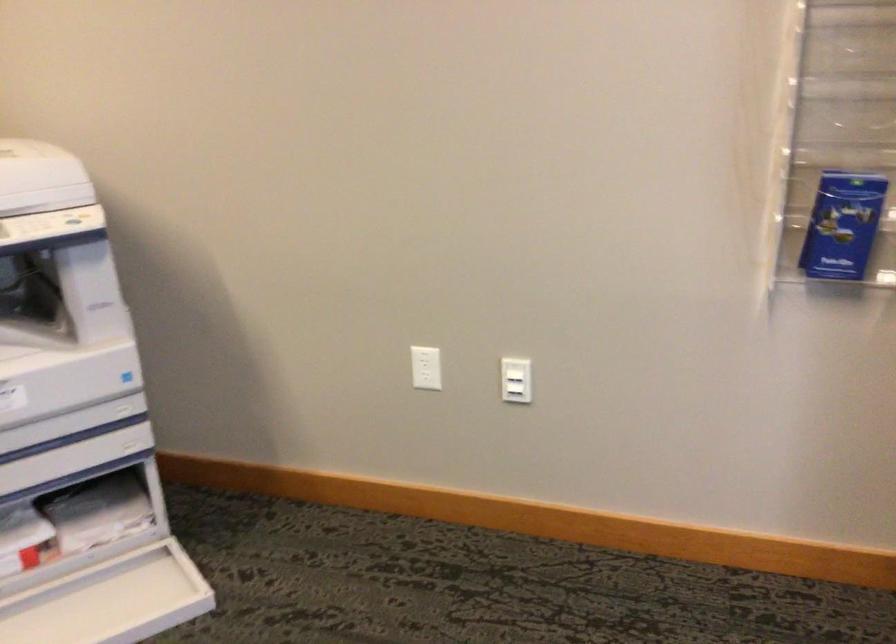
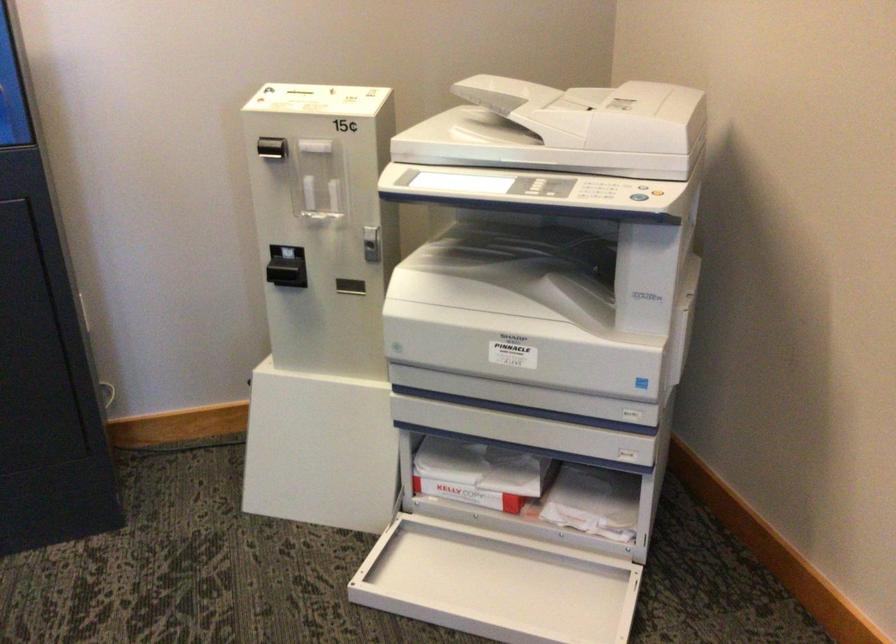
Where in the second image is the point corresponding to (x=140, y=375) from the first image?

(643, 384)